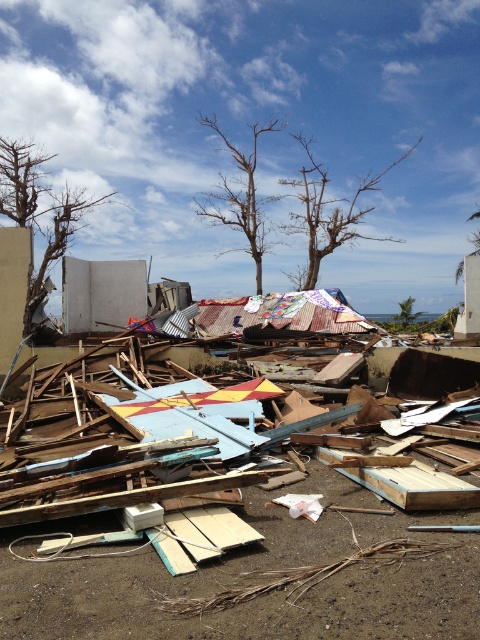
Which is below, bare wood tree at center or green leafy tree at center?

green leafy tree at center

Is bare wood tree at center to the left of green leafy tree at center from the viewer's perspective?

Indeed, bare wood tree at center is positioned on the left side of green leafy tree at center.

Is point (223, 220) closer to camera compared to point (414, 301)?

Yes, it is in front of point (414, 301).

Locate an element on the screen. Image resolution: width=480 pixels, height=640 pixels. bare wood tree at center is located at coordinates pyautogui.click(x=240, y=195).

Does brown wood tree at upper left lie behind bare wood tree at upper center?

No, brown wood tree at upper left is in front of bare wood tree at upper center.

Is brown wood tree at upper left to the left of bare wood tree at upper center from the viewer's perspective?

Yes, brown wood tree at upper left is to the left of bare wood tree at upper center.

You are a GUI agent. You are given a task and a screenshot of the screen. Output one action in this format:
    pyautogui.click(x=<x>, y=<y>)
    Task: Click on the brown wood tree at upper left
    
    Given the screenshot: What is the action you would take?
    pyautogui.click(x=39, y=212)

Which is behind, point (49, 252) or point (412, 300)?

The point (412, 300) is more distant.

Does brown wood tree at upper left have a greater width compared to green leafy tree at center?

Yes.

Is point (84, 216) behind point (409, 321)?

Yes.

Locate an element on the screen. Image resolution: width=480 pixels, height=640 pixels. brown wood tree at upper left is located at coordinates (39, 212).